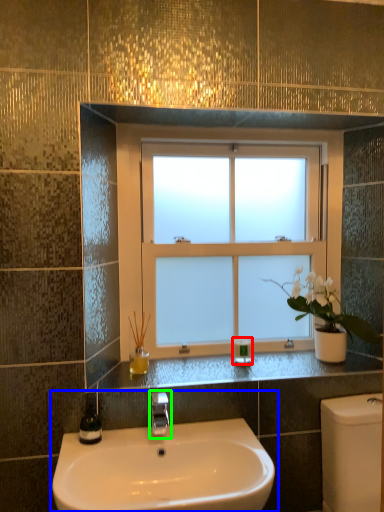
Question: Which object is positioned closest to toiletry (highlighted by a red box)? Select from sink (highlighted by a blue box) and tap (highlighted by a green box).

Choices:
 (A) sink
 (B) tap

Answer: (B)